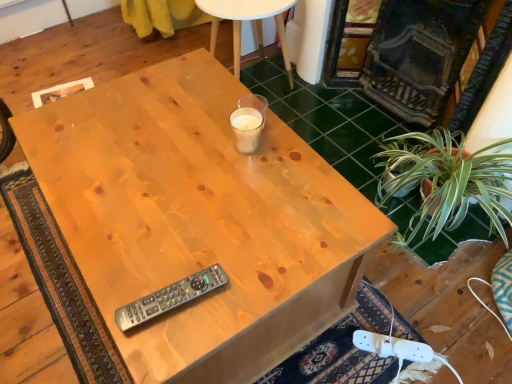
This screenshot has height=384, width=512. Identify the location of free space to the right of gray plastic remote at center. (245, 283).